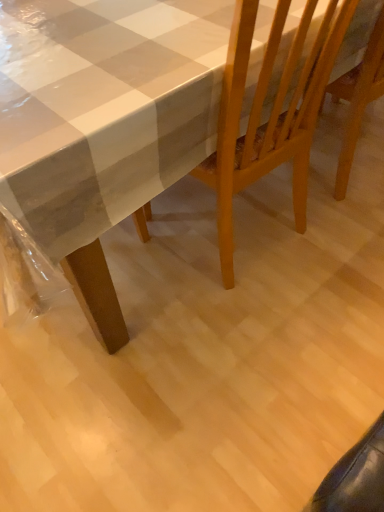
Question: Considering the relative sizes of white glossy table at upper left and wooden chair at center in the image provided, is white glossy table at upper left bigger than wooden chair at center?

Choices:
 (A) yes
 (B) no

Answer: (A)

Question: Does white glossy table at upper left have a lesser width compared to wooden chair at center?

Choices:
 (A) no
 (B) yes

Answer: (A)

Question: From the image's perspective, does white glossy table at upper left appear lower than wooden chair at center?

Choices:
 (A) no
 (B) yes

Answer: (A)

Question: From a real-world perspective, is white glossy table at upper left over wooden chair at center?

Choices:
 (A) no
 (B) yes

Answer: (A)

Question: From the image's perspective, is white glossy table at upper left on wooden chair at center?

Choices:
 (A) no
 (B) yes

Answer: (B)

Question: Is white glossy table at upper left at the left side of wooden chair at center?

Choices:
 (A) no
 (B) yes

Answer: (B)

Question: From a real-world perspective, is wooden chair at center over white glossy table at upper left?

Choices:
 (A) yes
 (B) no

Answer: (A)

Question: From the image's perspective, is wooden chair at center over white glossy table at upper left?

Choices:
 (A) yes
 (B) no

Answer: (B)

Question: Considering the relative sizes of wooden chair at center and white glossy table at upper left in the image provided, is wooden chair at center shorter than white glossy table at upper left?

Choices:
 (A) yes
 (B) no

Answer: (B)

Question: From the image's perspective, does wooden chair at center appear lower than white glossy table at upper left?

Choices:
 (A) yes
 (B) no

Answer: (A)

Question: Can you confirm if wooden chair at center is wider than white glossy table at upper left?

Choices:
 (A) yes
 (B) no

Answer: (B)

Question: Is wooden chair at center oriented away from white glossy table at upper left?

Choices:
 (A) yes
 (B) no

Answer: (A)

Question: In terms of width, does wooden chair at center look wider or thinner when compared to white glossy table at upper left?

Choices:
 (A) thin
 (B) wide

Answer: (A)